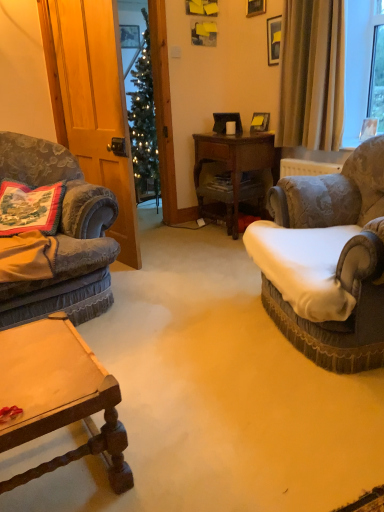
Image resolution: width=384 pixels, height=512 pixels. I want to click on free region on the left part of velvet-patterned armchair at right, which is the second chair from left to right, so click(186, 338).